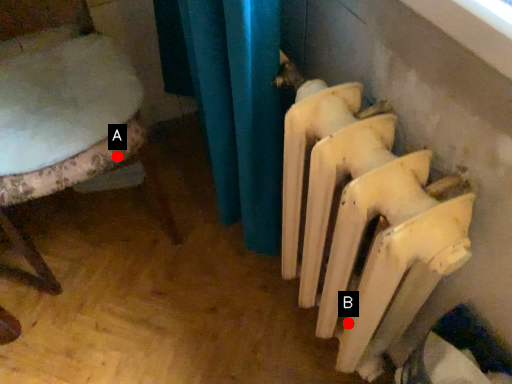
Question: Two points are circled on the image, labeled by A and B beside each circle. Which point is closer to the camera?

Choices:
 (A) A is closer
 (B) B is closer

Answer: (B)